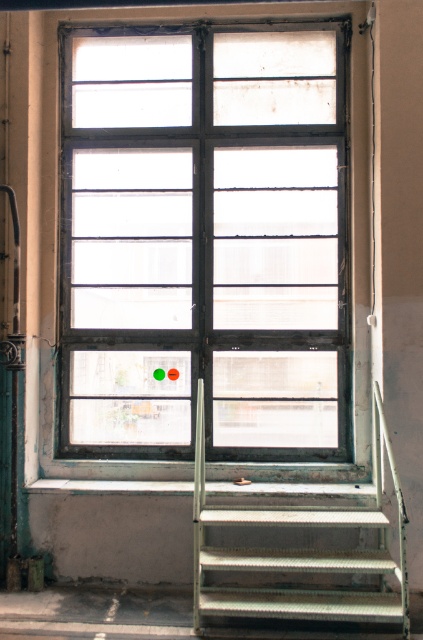
You are standing in the room looking at the window. What are the coordinates of the matte glass window at center?

The coordinates of the matte glass window at center are at point (x=203, y=241).

You are standing at the base of the metallic gray stairs at lower right and want to reach the matte glass window at center. Which direction should you move to get closer to the window?

You should move to the left to get closer to the matte glass window at center since it is located to the left of the metallic gray stairs at lower right.

You are a delivery robot with a package that is 1.5 meters long. You need to move from the metallic gray stairs at lower right to the matte glass window at center to deliver the package. Can you fit the package between them without bending it?

The distance between the matte glass window at center and the metallic gray stairs at lower right is 1.20 meters. Since the package is 1.5 meters long, it cannot fit between them without bending.